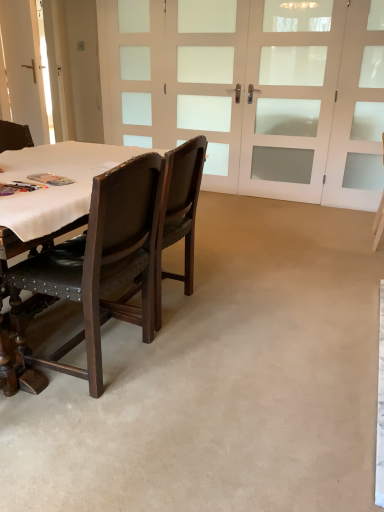
Question: Is white glass doors at upper center, arranged as the second screen door when viewed from the right, closer to the viewer compared to white fabric table at left?

Choices:
 (A) yes
 (B) no

Answer: (B)

Question: Does white glass doors at upper center, arranged as the 2th screen door when viewed from the left, have a larger size compared to white fabric table at left?

Choices:
 (A) yes
 (B) no

Answer: (A)

Question: Is white glass doors at upper center, arranged as the 2th screen door when viewed from the left, oriented away from white fabric table at left?

Choices:
 (A) no
 (B) yes

Answer: (A)

Question: From a real-world perspective, is white glass doors at upper center, arranged as the 2th screen door when viewed from the left, beneath white fabric table at left?

Choices:
 (A) yes
 (B) no

Answer: (B)

Question: Can we say white glass doors at upper center, arranged as the second screen door when viewed from the right, lies outside white fabric table at left?

Choices:
 (A) yes
 (B) no

Answer: (A)

Question: Is white glass doors at upper center, arranged as the second screen door when viewed from the right, shorter than white fabric table at left?

Choices:
 (A) no
 (B) yes

Answer: (A)

Question: Does white fabric table at left have a greater height compared to white glass doors at center, which is the first screen door in left-to-right order?

Choices:
 (A) no
 (B) yes

Answer: (A)

Question: Considering the relative sizes of white fabric table at left and white glass doors at center, which is the first screen door in left-to-right order, in the image provided, is white fabric table at left wider than white glass doors at center, which is the first screen door in left-to-right order,?

Choices:
 (A) yes
 (B) no

Answer: (A)

Question: Is white fabric table at left closer to the viewer compared to white glass doors at center, positioned as the 3th screen door in right-to-left order?

Choices:
 (A) yes
 (B) no

Answer: (A)

Question: From a real-world perspective, is white fabric table at left on white glass doors at center, positioned as the 3th screen door in right-to-left order?

Choices:
 (A) no
 (B) yes

Answer: (A)

Question: Is white fabric table at left at the left side of white glass doors at center, positioned as the 3th screen door in right-to-left order?

Choices:
 (A) no
 (B) yes

Answer: (B)

Question: Is white glass doors at center, positioned as the 3th screen door in right-to-left order, a part of white fabric table at left?

Choices:
 (A) yes
 (B) no

Answer: (B)

Question: Does white frosted glass screen door at upper right, marked as the 1th screen door in a right-to-left arrangement, have a lesser height compared to white leather chair at right, the 1th chair when ordered from back to front?

Choices:
 (A) no
 (B) yes

Answer: (A)